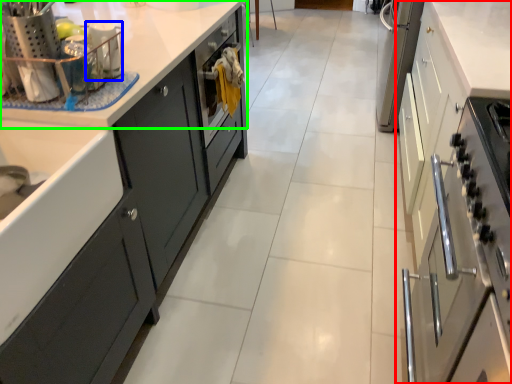
Question: Which object is the farthest from cabinetry (highlighted by a red box)? Choose among these: appliance (highlighted by a blue box) or countertop (highlighted by a green box).

Choices:
 (A) appliance
 (B) countertop

Answer: (A)